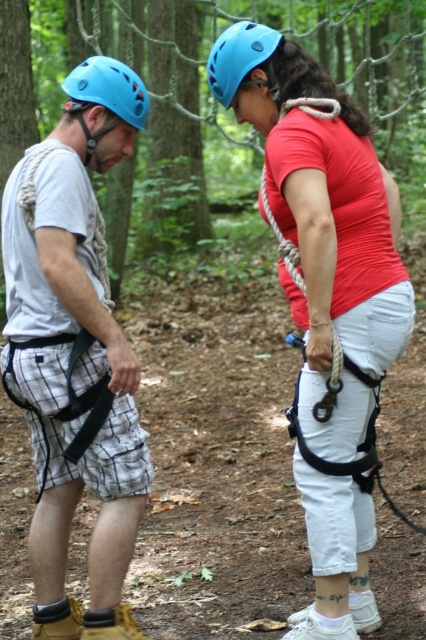
You are an observer standing in front of the image. You need to determine if the distance between the matte red shirt at center and the matte black harness at left is sufficient for a 30 inch wide backpack to fit between them. Can you confirm?

The matte red shirt at center and the matte black harness at left are 30.19 inches apart. Since the backpack is 30 inches wide, there is enough space for the backpack to fit between them.